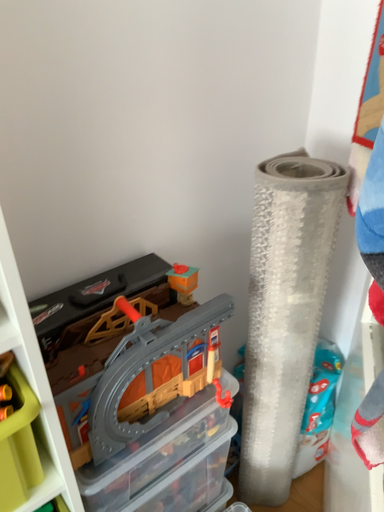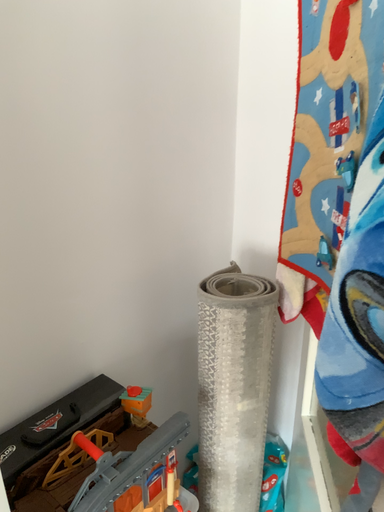
Question: Which way did the camera rotate in the video?

Choices:
 (A) rotated downward
 (B) rotated upward

Answer: (B)